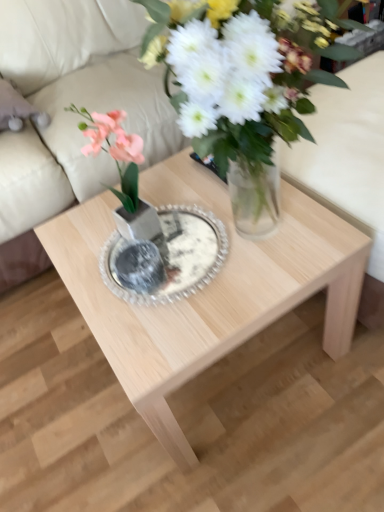
Image resolution: width=384 pixels, height=512 pixels. What do you see at coordinates (115, 153) in the screenshot?
I see `pink silk flower at center` at bounding box center [115, 153].

Describe the element at coordinates (166, 257) in the screenshot. I see `clear glass plate at center` at that location.

Identify the location of pink silk flower at center. This screenshot has height=512, width=384. coord(115,153).

Which object is closer to the camera taking this photo, pink silk flower at center or beige fabric couch at upper center?

pink silk flower at center.

Considering the relative sizes of pink silk flower at center and beige fabric couch at upper center in the image provided, is pink silk flower at center thinner than beige fabric couch at upper center?

Yes.

Considering the relative positions of pink silk flower at center and beige fabric couch at upper center in the image provided, is pink silk flower at center to the right of beige fabric couch at upper center from the viewer's perspective?

Yes.

Is pink silk flower at center inside or outside of beige fabric couch at upper center?

The correct answer is: outside.

From the image's perspective, is natural wood coffee table at center beneath pink silk flower at center?

Correct, natural wood coffee table at center appears lower than pink silk flower at center in the image.

How far apart are natural wood coffee table at center and pink silk flower at center?

9.26 inches.

Can you confirm if natural wood coffee table at center is wider than pink silk flower at center?

Yes.

Is natural wood coffee table at center facing towards pink silk flower at center?

No.

From a real-world perspective, is clear glass plate at center positioned over pink silk flower at center based on gravity?

No.

Would you consider clear glass plate at center to be distant from pink silk flower at center?

No, there isn't a large distance between clear glass plate at center and pink silk flower at center.

Can you confirm if clear glass plate at center is positioned to the left of pink silk flower at center?

No.

At what (x,y) coordinates should I click in order to perform the action: click on coffee table below the beige fabric couch at upper center (from the image's perspective). Please return your answer as a coordinate pair (x, y). The height and width of the screenshot is (512, 384). Looking at the image, I should click on (206, 288).

Consider the image. Considering the sizes of beige fabric couch at upper center and natural wood coffee table at center in the image, is beige fabric couch at upper center bigger or smaller than natural wood coffee table at center?

beige fabric couch at upper center is bigger than natural wood coffee table at center.

Considering the sizes of objects beige fabric couch at upper center and natural wood coffee table at center in the image provided, who is shorter, beige fabric couch at upper center or natural wood coffee table at center?

Standing shorter between the two is natural wood coffee table at center.

Is beige fabric couch at upper center further to the viewer compared to pink silk flower at center?

Yes, beige fabric couch at upper center is further from the camera.

From the image's perspective, which one is positioned lower, beige fabric couch at upper center or pink silk flower at center?

pink silk flower at center appears lower in the image.

Considering the sizes of beige fabric couch at upper center and pink silk flower at center in the image, is beige fabric couch at upper center wider or thinner than pink silk flower at center?

In the image, beige fabric couch at upper center appears to be wider than pink silk flower at center.

Could you tell me if beige fabric couch at upper center is facing pink silk flower at center?

Yes, beige fabric couch at upper center is aimed at pink silk flower at center.

Is pink silk flower at center at the left side of clear glass plate at center?

Yes, pink silk flower at center is to the left of clear glass plate at center.

Is there a large distance between pink silk flower at center and clear glass plate at center?

pink silk flower at center is near clear glass plate at center, not far away.

From the image's perspective, which one is positioned lower, pink silk flower at center or clear glass plate at center?

clear glass plate at center appears lower in the image.

From a real-world perspective, is pink silk flower at center over clear glass plate at center?

Yes.

Which object is closer to the camera taking this photo, clear glass plate at center or beige fabric couch at upper center?

Positioned in front is clear glass plate at center.

What's the angular difference between clear glass plate at center and beige fabric couch at upper center's facing directions?

1.8 degrees separate the facing orientations of clear glass plate at center and beige fabric couch at upper center.

Which point is more distant from viewer, (160, 262) or (64, 204)?

The point (64, 204) is behind.

Is clear glass plate at center aimed at beige fabric couch at upper center?

No.

Find the location of `couch lying above the pink silk flower at center (from the image's perspective)`. couch lying above the pink silk flower at center (from the image's perspective) is located at coordinates (70, 114).

Locate an element on the screen. coffee table below the pink silk flower at center (from the image's perspective) is located at coordinates (206, 288).

Considering their positions, is natural wood coffee table at center positioned closer to beige fabric couch at upper center than pink silk flower at center?

natural wood coffee table at center is closer to beige fabric couch at upper center.

Based on their spatial positions, is clear glass plate at center or pink silk flower at center closer to beige fabric couch at upper center?

clear glass plate at center is closer to beige fabric couch at upper center.

When comparing their distances from beige fabric couch at upper center, does clear glass plate at center or natural wood coffee table at center seem further?

clear glass plate at center is positioned further to the anchor beige fabric couch at upper center.

Estimate the real-world distances between objects in this image. Which object is further from pink silk flower at center, clear glass plate at center or natural wood coffee table at center?

natural wood coffee table at center.

Which object lies nearer to the anchor point natural wood coffee table at center, clear glass plate at center or pink silk flower at center?

Based on the image, clear glass plate at center appears to be nearer to natural wood coffee table at center.

When comparing their distances from pink silk flower at center, does natural wood coffee table at center or beige fabric couch at upper center seem closer?

The object closer to pink silk flower at center is natural wood coffee table at center.

Considering their positions, is beige fabric couch at upper center positioned further to clear glass plate at center than natural wood coffee table at center?

beige fabric couch at upper center lies further to clear glass plate at center than the other object.

When comparing their distances from natural wood coffee table at center, does pink silk flower at center or clear glass plate at center seem further?

pink silk flower at center is positioned further to the anchor natural wood coffee table at center.

The width and height of the screenshot is (384, 512). What are the coordinates of `glass plate that lies between beige fabric couch at upper center and natural wood coffee table at center from top to bottom` in the screenshot? It's located at (166, 257).

Locate an element on the screen. houseplant between beige fabric couch at upper center and natural wood coffee table at center in the up-down direction is located at coordinates (115, 153).

Identify the location of houseplant that lies between beige fabric couch at upper center and clear glass plate at center from top to bottom. The width and height of the screenshot is (384, 512). (115, 153).

Locate an element on the screen. glass plate between pink silk flower at center and natural wood coffee table at center vertically is located at coordinates (166, 257).